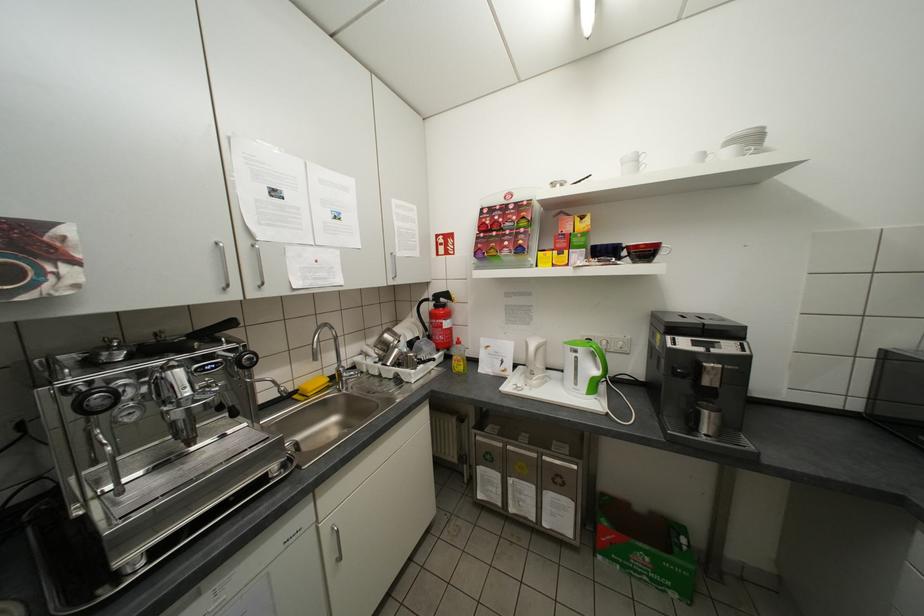
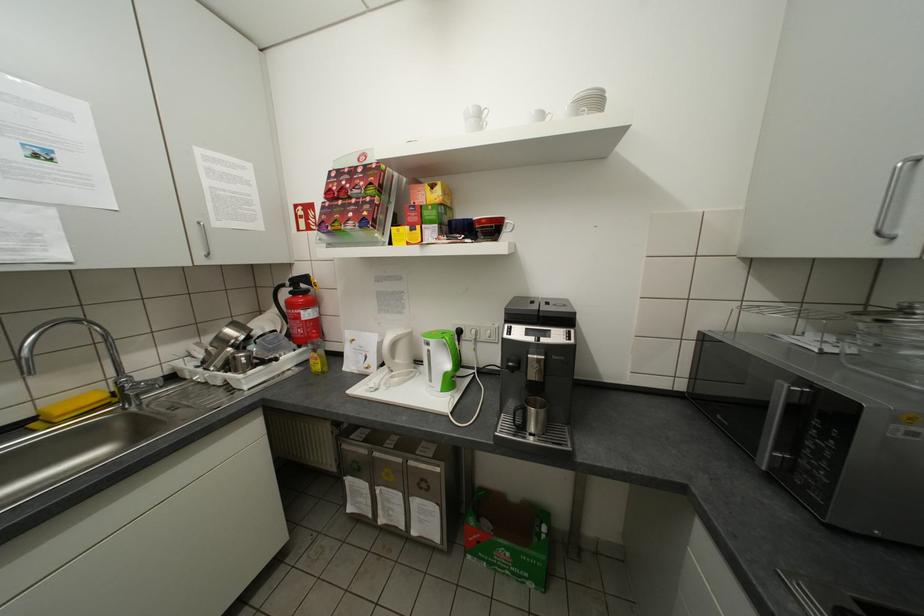
The point at (714, 430) is marked in the first image. Where is the corresponding point in the second image?

(541, 428)